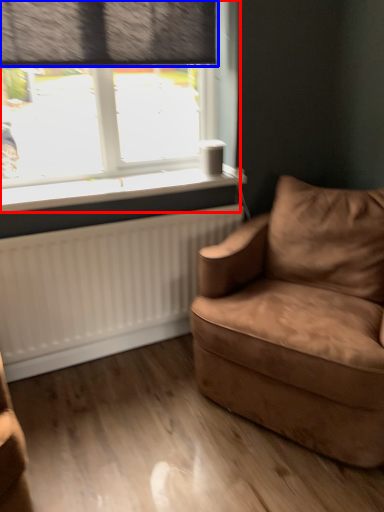
Question: Which point is further to the camera, window (highlighted by a red box) or curtain (highlighted by a blue box)?

Choices:
 (A) window
 (B) curtain

Answer: (A)